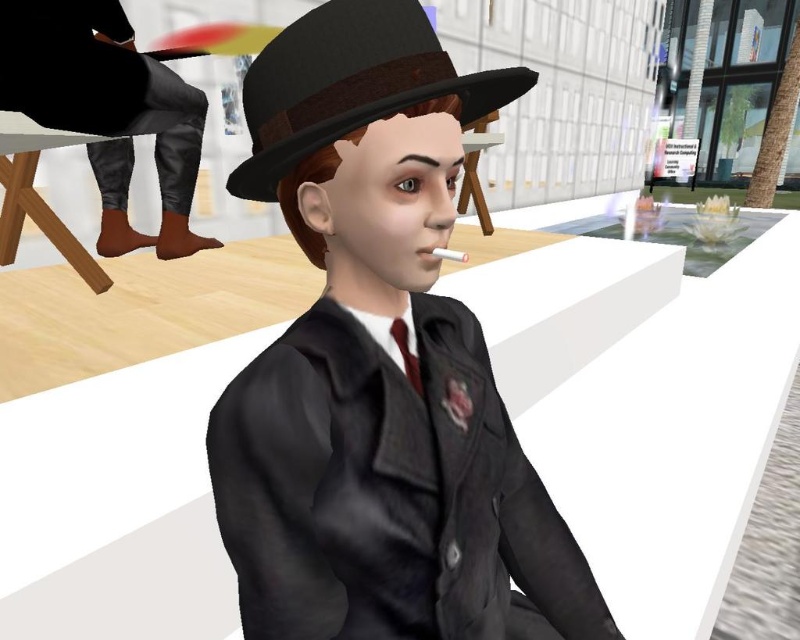
Does matte black suit at center have a larger size compared to matte brown fedora at center?

Yes, matte black suit at center is bigger than matte brown fedora at center.

Does point (522, 588) come closer to viewer compared to point (396, 109)?

That is False.

The width and height of the screenshot is (800, 640). What are the coordinates of `matte black suit at center` in the screenshot? It's located at (380, 365).

Who is higher up, leather pants at left or matte brown fedora at center?

leather pants at left is higher up.

Between point (110, 211) and point (252, 184), which one is positioned in front?

Point (252, 184) is more forward.

Is point (46, 115) closer to camera compared to point (490, 99)?

No, (46, 115) is behind (490, 99).

Locate an element on the screen. Image resolution: width=800 pixels, height=640 pixels. leather pants at left is located at coordinates 106,106.

From the picture: Can you confirm if matte black suit at center is wider than dark red satin tie at center?

Correct, the width of matte black suit at center exceeds that of dark red satin tie at center.

Is point (545, 536) farther from camera compared to point (396, 333)?

Yes, it is behind point (396, 333).

Which is in front, point (442, 406) or point (406, 344)?

Positioned in front is point (442, 406).

Find the location of a particular element. matte black suit at center is located at coordinates (380, 365).